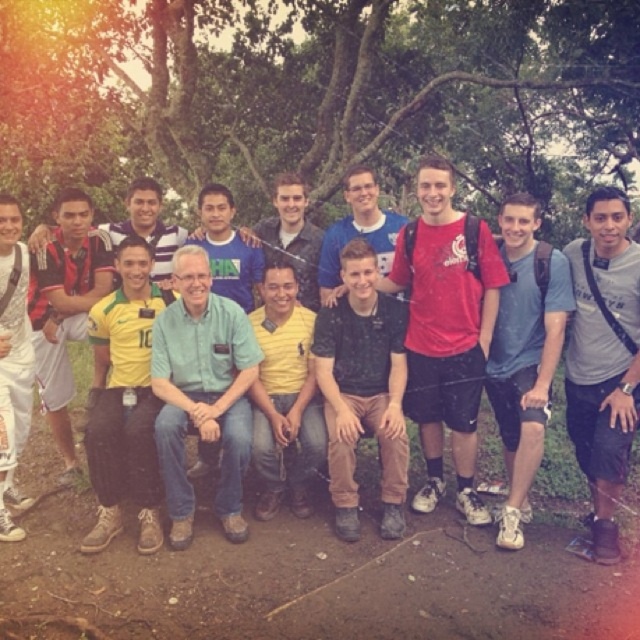
You are a photographer trying to adjust the composition of this group photo. You notice two individuals wearing a matte blue shirt at center and a matte black shirt at center. Which of these two shirts is worn by someone who is shorter?

The matte blue shirt at center is worn by someone who is shorter compared to the matte black shirt at center, as the matte blue shirt at center has a lesser height.

You are a photographer trying to capture a clear shot of the white matte pants at left and the matte black shirt at center. Since the camera can only focus on one object at a time, which object should you choose to ensure it appears sharp and in focus, considering their sizes?

The white matte pants at left is larger in size than the matte black shirt at center, so focusing on the white matte pants at left would ensure it appears sharp and in focus.